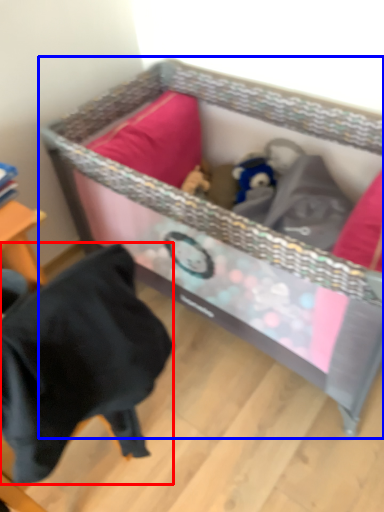
Question: Which of the following is the farthest to the observer, clothing (highlighted by a red box) or infant bed (highlighted by a blue box)?

Choices:
 (A) clothing
 (B) infant bed

Answer: (B)